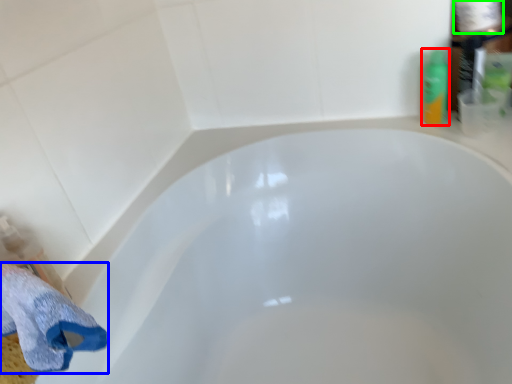
Question: Which is nearer to the toiletry (highlighted by a red box)? bath towel (highlighted by a blue box) or toilet paper (highlighted by a green box).

Choices:
 (A) bath towel
 (B) toilet paper

Answer: (B)